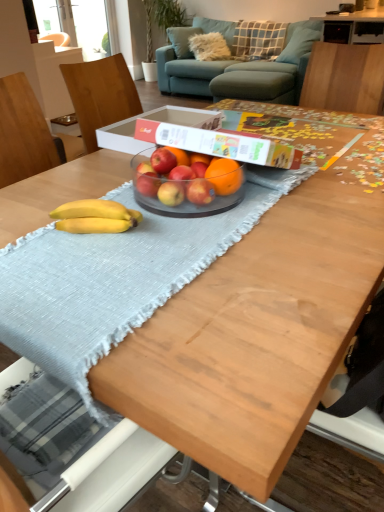
At what (x,y) coordinates should I click in order to perform the action: click on vacant area that is in front of red matte apple at center, which is the 2th apple in right-to-left order. Please return your answer as a coordinate pair (x, y). The width and height of the screenshot is (384, 512). Looking at the image, I should click on (170, 226).